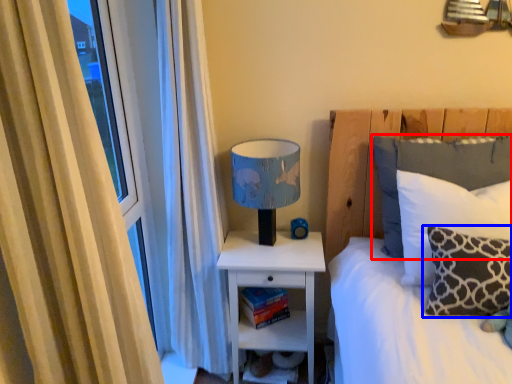
Question: Among these objects, which one is farthest to the camera, pillow (highlighted by a red box) or pillow (highlighted by a blue box)?

Choices:
 (A) pillow
 (B) pillow

Answer: (A)